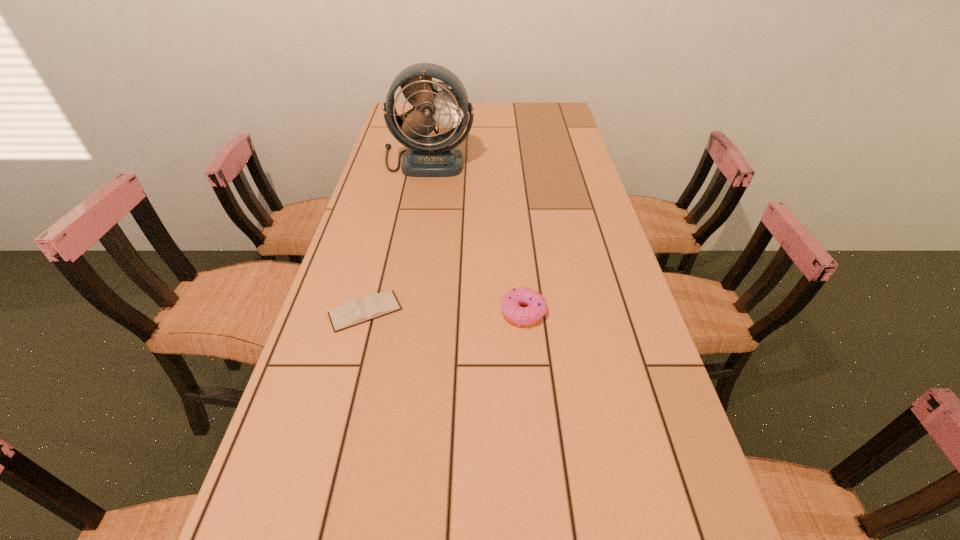
The image size is (960, 540). I want to click on vacant region between the diary and the farthest object, so [x=402, y=212].

The image size is (960, 540). I want to click on vacant point located between the rightmost object and the shortest object, so click(x=444, y=312).

This screenshot has height=540, width=960. Identify the location of free spot between the diary and the can. (402, 212).

Locate an element on the screen. Image resolution: width=960 pixels, height=540 pixels. vacant point located between the can and the shortest object is located at coordinates (402, 212).

Identify the location of unoccupied position between the can and the diary. (402, 212).

Identify which object is located as the nearest to the tallest object. Please provide its 2D coordinates. Your answer should be formatted as a tuple, i.e. [(x, y)], where the tuple contains the x and y coordinates of a point satisfying the conditions above.

[(442, 83)]

At what (x,y) coordinates should I click in order to perform the action: click on object that can be found as the closest to the doughnut. Please return your answer as a coordinate pair (x, y). Image resolution: width=960 pixels, height=540 pixels. Looking at the image, I should click on (372, 306).

The height and width of the screenshot is (540, 960). Identify the location of free space that satisfies the following two spatial constraints: 1. in front of the rightmost object to blow air; 2. on the left side of the second farthest object. (401, 312).